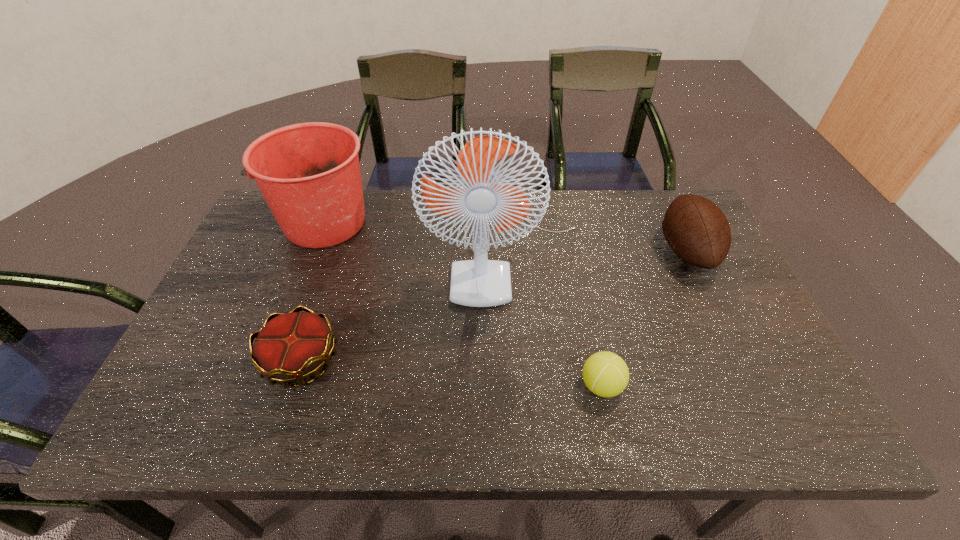
The image size is (960, 540). I want to click on free space located 0.230m on the laces of the third shortest object, so click(580, 251).

The height and width of the screenshot is (540, 960). I want to click on vacant space located 0.350m on the back of the crown, so click(343, 237).

Locate an element on the screen. free point located 0.060m on the right of the tennis ball is located at coordinates (650, 386).

You are a GUI agent. You are given a task and a screenshot of the screen. Output one action in this format:
    pyautogui.click(x=<x>, y=<y>)
    Task: Click on the fan present at the far edge
    This screenshot has height=540, width=960.
    Given the screenshot: What is the action you would take?
    (x=480, y=282)

Find the location of a particular element. This screenshot has height=540, width=960. bucket that is positioned at the far edge is located at coordinates (309, 174).

What are the coordinates of `football located in the far edge section of the desktop` in the screenshot? It's located at (698, 232).

Find the location of a particular element. object present at the near edge is located at coordinates pos(605,374).

What are the coordinates of `object that is at the left edge` in the screenshot? It's located at (309, 174).

Locate an element on the screen. The height and width of the screenshot is (540, 960). object that is at the right edge is located at coordinates (698, 232).

You are a GUI agent. You are given a task and a screenshot of the screen. Output one action in this format:
    pyautogui.click(x=<x>, y=<y>)
    Task: Click on the object located at the far left corner
    
    Given the screenshot: What is the action you would take?
    pyautogui.click(x=309, y=174)